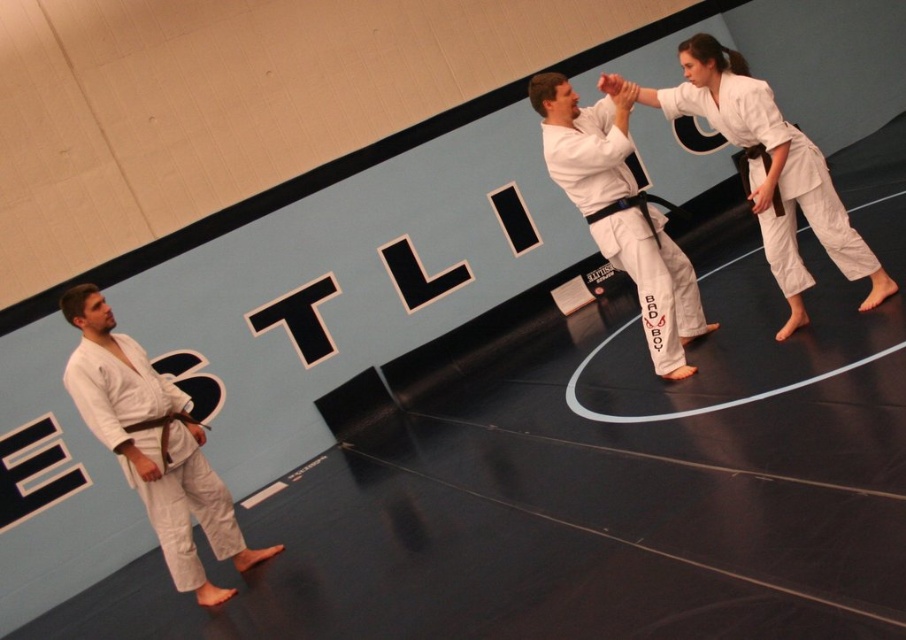
Is white matte kimono at left below white matte karate gi at center?

Indeed, white matte kimono at left is positioned under white matte karate gi at center.

Is white matte kimono at left shorter than white matte karate gi at center?

No, white matte kimono at left is not shorter than white matte karate gi at center.

The image size is (906, 640). What are the coordinates of `white matte kimono at left` in the screenshot? It's located at (153, 444).

Between point (660, 307) and point (601, 218), which one is positioned behind?

Point (660, 307)

What do you see at coordinates (584, 140) in the screenshot? The image size is (906, 640). I see `white karate uniform at center` at bounding box center [584, 140].

The image size is (906, 640). Describe the element at coordinates (584, 140) in the screenshot. I see `white karate uniform at center` at that location.

Locate an element on the screen. white karate uniform at center is located at coordinates (584, 140).

Between white matte karate gi at center and black leather belt at center, which one has more height?

With more height is white matte karate gi at center.

Does white matte karate gi at center have a greater height compared to black leather belt at center?

Yes.

Who is more distant from viewer, (816, 209) or (635, 198)?

Point (635, 198)

You are a GUI agent. You are given a task and a screenshot of the screen. Output one action in this format:
    pyautogui.click(x=<x>, y=<y>)
    Task: Click on the white matte karate gi at center
    
    Given the screenshot: What is the action you would take?
    pyautogui.click(x=770, y=172)